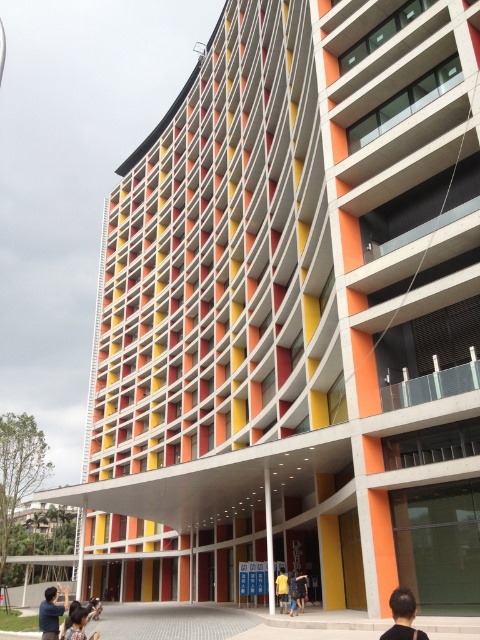
Question: Which object appears closest to the camera in this image?

Choices:
 (A) yellow casual shirt at center
 (B) black hair at lower center
 (C) dark blue shirt at center

Answer: (B)

Question: Among these objects, which one is farthest from the camera?

Choices:
 (A) yellow casual shirt at center
 (B) dark blue shirt at lower left

Answer: (A)

Question: Does black hair at lower center appear over dark blue shirt at center?

Choices:
 (A) no
 (B) yes

Answer: (B)

Question: Is dark brown hair at lower left to the right of yellow casual shirt at center from the viewer's perspective?

Choices:
 (A) yes
 (B) no

Answer: (B)

Question: Is black hair at lower center closer to camera compared to dark brown hair at lower left?

Choices:
 (A) yes
 (B) no

Answer: (A)

Question: Which point appears closest to the camera in this image?

Choices:
 (A) (292, 579)
 (B) (48, 624)
 (C) (393, 612)

Answer: (C)